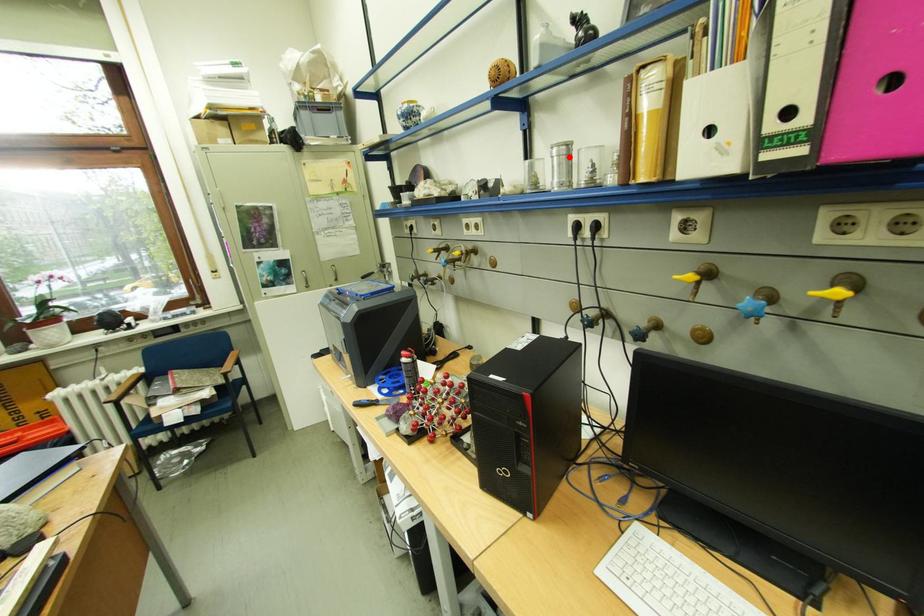
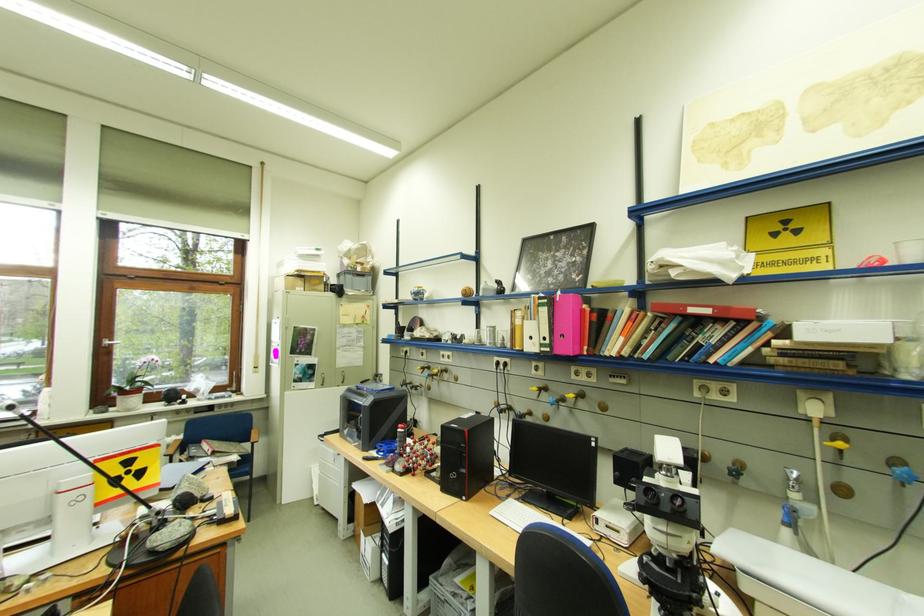
The point at the highlighted location is marked in the first image. Where is the corresponding point in the second image?

(500, 331)